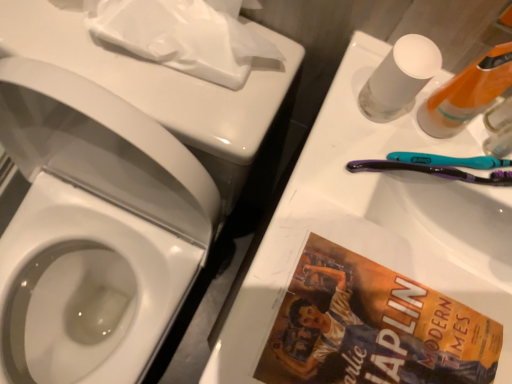
Where is `vacant region in front of white matte toilet paper at upper left`? vacant region in front of white matte toilet paper at upper left is located at coordinates (158, 108).